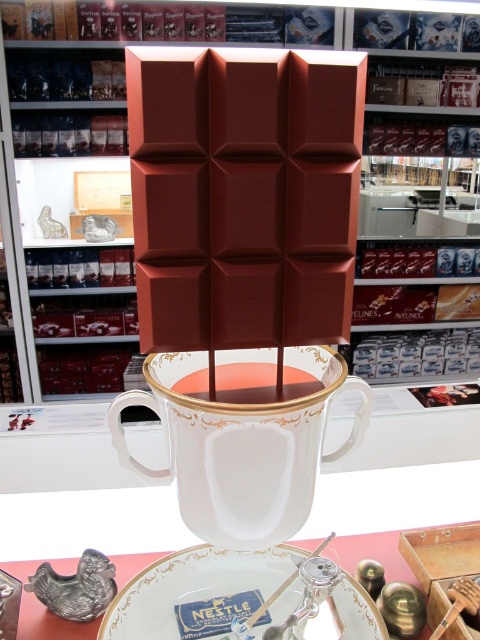
Image resolution: width=480 pixels, height=640 pixels. What do you see at coordinates (242, 436) in the screenshot? I see `white porcelain cup at center` at bounding box center [242, 436].

Measure the distance from white porcelain cup at center to white glossy saucer at center.

white porcelain cup at center is 6.99 inches from white glossy saucer at center.

Does point (168, 401) come farther from viewer compared to point (152, 593)?

No, (168, 401) is in front of (152, 593).

This screenshot has width=480, height=640. I want to click on white porcelain cup at center, so click(x=242, y=436).

In the scene shown: Between white glossy saucer at center and white porcelain plate at center, which one appears on the right side from the viewer's perspective?

From the viewer's perspective, white glossy saucer at center appears more on the right side.

Looking at this image, does white glossy saucer at center come in front of white porcelain plate at center?

That is True.

The image size is (480, 640). Identify the location of white glossy saucer at center. (240, 593).

The image size is (480, 640). What are the coordinates of `white glossy saucer at center` in the screenshot? It's located at (240, 593).

Can you confirm if white porcelain cup at center is positioned below white porcelain plate at center?

Incorrect, white porcelain cup at center is not positioned below white porcelain plate at center.

Can you confirm if white porcelain cup at center is bigger than white porcelain plate at center?

Incorrect, white porcelain cup at center is not larger than white porcelain plate at center.

Between point (205, 513) and point (71, 625), which one is positioned behind?

The point (71, 625) is more distant.

The image size is (480, 640). I want to click on white porcelain cup at center, so click(242, 436).